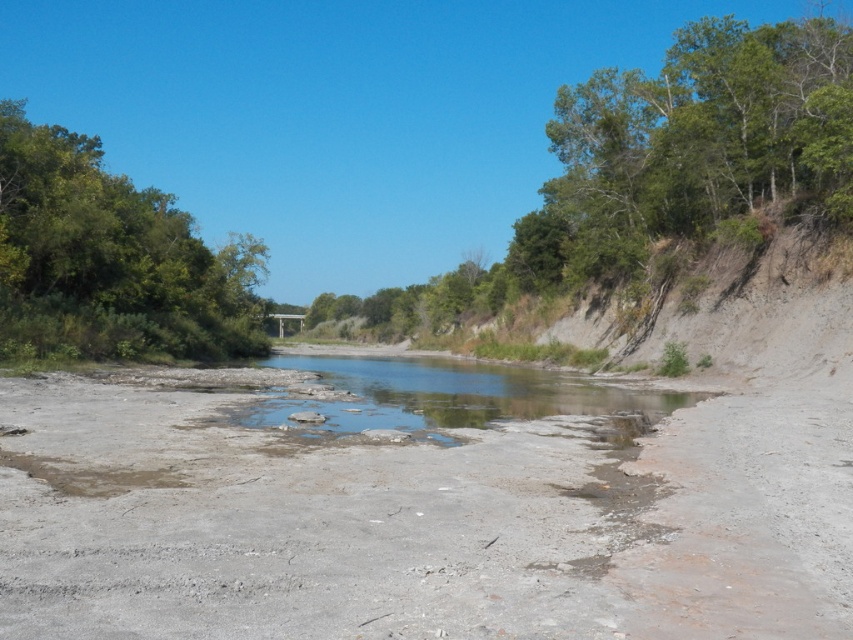
What do you see at coordinates (660, 170) in the screenshot? This screenshot has width=853, height=640. I see `green leafy trees at upper right` at bounding box center [660, 170].

Is green leafy trees at upper right thinner than green leafy tree at upper left?

In fact, green leafy trees at upper right might be wider than green leafy tree at upper left.

Measure the distance between green leafy trees at upper right and camera.

They are 36.47 meters apart.

You are a GUI agent. You are given a task and a screenshot of the screen. Output one action in this format:
    pyautogui.click(x=<x>, y=<y>)
    Task: Click on the green leafy trees at upper right
    This screenshot has width=853, height=640.
    Given the screenshot: What is the action you would take?
    click(x=660, y=170)

Can you confirm if green leafy tree at upper left is thinner than clear water at center?

No.

Is green leafy tree at upper left to the right of clear water at center from the viewer's perspective?

Incorrect, green leafy tree at upper left is not on the right side of clear water at center.

The width and height of the screenshot is (853, 640). What do you see at coordinates (109, 260) in the screenshot?
I see `green leafy tree at upper left` at bounding box center [109, 260].

Find the location of a particular element. This screenshot has width=853, height=640. green leafy tree at upper left is located at coordinates (109, 260).

Who is taller, green leafy trees at upper right or clear water at center?

green leafy trees at upper right

Does point (706, 152) lie behind point (376, 416)?

Yes, it is behind point (376, 416).

Where is `green leafy trees at upper right`? green leafy trees at upper right is located at coordinates (660, 170).

Where is `green leafy trees at upper right`? The image size is (853, 640). green leafy trees at upper right is located at coordinates (660, 170).